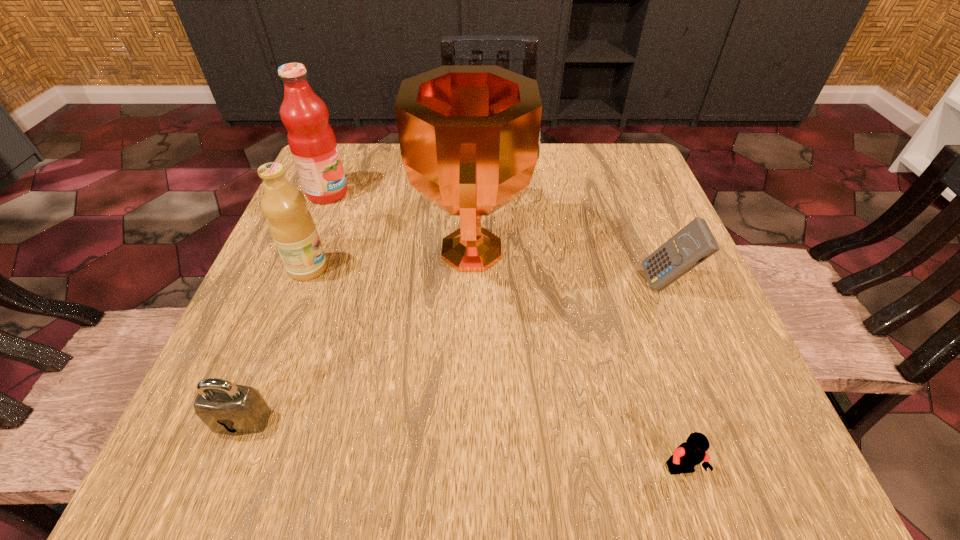
Find the location of a particular element. vacant region at the far right corner of the desktop is located at coordinates (594, 190).

You are a GUI agent. You are given a task and a screenshot of the screen. Output one action in this format:
    pyautogui.click(x=<x>, y=<y>)
    Task: Click on the vacant area that lies between the padlock and the third object from right to left
    The width and height of the screenshot is (960, 540).
    Given the screenshot: What is the action you would take?
    pyautogui.click(x=358, y=336)

Identify the location of free area in between the fruit juice and the nearest object. (505, 332).

What are the coordinates of `free space between the padlock and the olive oil` in the screenshot? It's located at (276, 345).

Locate an element on the screen. unoccupied area between the award and the third shortest object is located at coordinates (570, 267).

The image size is (960, 540). In order to click on vacant area that lies between the olive oil and the award in this screenshot , I will do `click(391, 260)`.

Image resolution: width=960 pixels, height=540 pixels. What are the coordinates of `unoccupied area between the Lego and the fourth object from left to right` in the screenshot? It's located at (578, 361).

Locate an element on the screen. blank region between the fourth shortest object and the padlock is located at coordinates (276, 345).

This screenshot has height=540, width=960. Identify the location of vacant region between the fifth tallest object and the nearest object. (462, 445).

I want to click on vacant space that is in between the olive oil and the third shortest object, so click(488, 276).